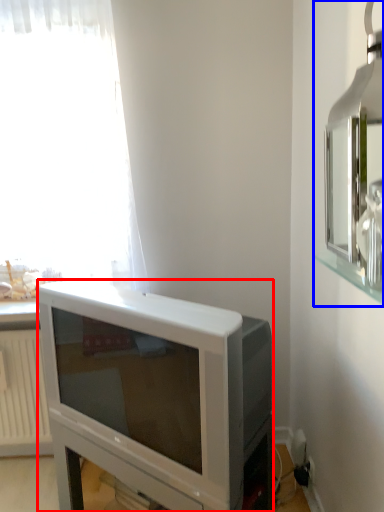
Question: Which point is further to the camera, television (highlighted by a red box) or medicine cabinet (highlighted by a blue box)?

Choices:
 (A) television
 (B) medicine cabinet

Answer: (A)